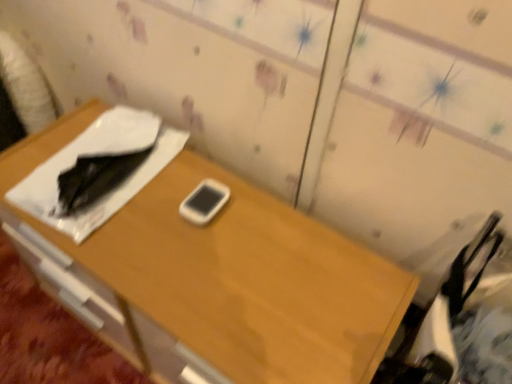
Question: Should I look upward or downward to see wooden desk at center?

Choices:
 (A) up
 (B) down

Answer: (B)

Question: Is white matte mobile phone at center not near wooden desk at center?

Choices:
 (A) yes
 (B) no

Answer: (B)

Question: Is white matte mobile phone at center taller than wooden desk at center?

Choices:
 (A) yes
 (B) no

Answer: (B)

Question: Can you confirm if white matte mobile phone at center is smaller than wooden desk at center?

Choices:
 (A) yes
 (B) no

Answer: (A)

Question: From the image's perspective, would you say white matte mobile phone at center is shown under wooden desk at center?

Choices:
 (A) yes
 (B) no

Answer: (B)

Question: Can wooden desk at center be found inside white matte mobile phone at center?

Choices:
 (A) yes
 (B) no

Answer: (B)

Question: From a real-world perspective, is white matte mobile phone at center over wooden desk at center?

Choices:
 (A) yes
 (B) no

Answer: (A)

Question: Can you confirm if wooden desk at center is thinner than white matte mobile phone at center?

Choices:
 (A) no
 (B) yes

Answer: (A)

Question: Considering the relative sizes of wooden desk at center and white matte mobile phone at center in the image provided, is wooden desk at center shorter than white matte mobile phone at center?

Choices:
 (A) no
 (B) yes

Answer: (A)

Question: From the image's perspective, does wooden desk at center appear higher than white matte mobile phone at center?

Choices:
 (A) yes
 (B) no

Answer: (B)

Question: Is white matte mobile phone at center at the back of wooden desk at center?

Choices:
 (A) no
 (B) yes

Answer: (A)

Question: Is wooden desk at center facing towards white matte mobile phone at center?

Choices:
 (A) no
 (B) yes

Answer: (A)

Question: Is wooden desk at center surrounding white matte mobile phone at center?

Choices:
 (A) no
 (B) yes

Answer: (B)

Question: From a real-world perspective, is wooden desk at center above or below white matte mobile phone at center?

Choices:
 (A) above
 (B) below

Answer: (B)